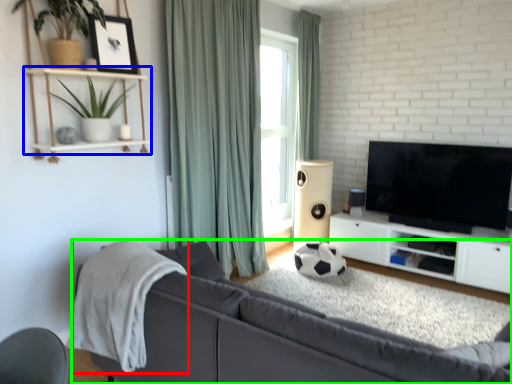
Question: Which object is positioned closest to blanket (highlighted by a red box)? Select from shelf (highlighted by a blue box) and studio couch (highlighted by a green box).

Choices:
 (A) shelf
 (B) studio couch

Answer: (B)